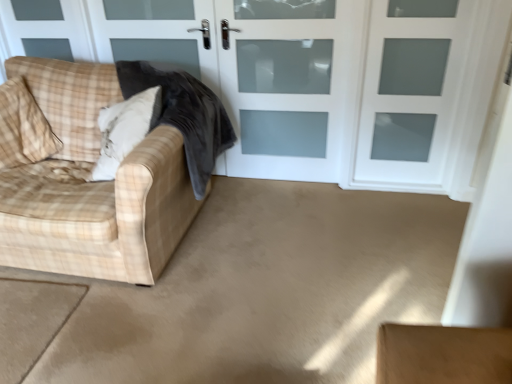
Question: Considering the relative sizes of white frosted glass screen door at upper center, placed as the 2th screen door when sorted from left to right, and plush white pillow at left, which is the first pillow in right-to-left order, in the image provided, is white frosted glass screen door at upper center, placed as the 2th screen door when sorted from left to right, smaller than plush white pillow at left, which is the first pillow in right-to-left order,?

Choices:
 (A) no
 (B) yes

Answer: (B)

Question: Does white frosted glass screen door at upper center, placed as the 2th screen door when sorted from left to right, turn towards plush white pillow at left, the second pillow from the left?

Choices:
 (A) yes
 (B) no

Answer: (B)

Question: Could plush white pillow at left, which is the first pillow in right-to-left order, be considered to be inside white frosted glass screen door at upper center, which is counted as the 1th screen door, starting from the right?

Choices:
 (A) yes
 (B) no

Answer: (B)

Question: Is the surface of white frosted glass screen door at upper center, placed as the 2th screen door when sorted from left to right, in direct contact with plush white pillow at left, the second pillow from the left?

Choices:
 (A) yes
 (B) no

Answer: (B)

Question: Can you confirm if white frosted glass screen door at upper center, placed as the 2th screen door when sorted from left to right, is bigger than plush white pillow at left, which is the first pillow in right-to-left order?

Choices:
 (A) yes
 (B) no

Answer: (B)

Question: Considering their positions, is velvet dark gray blanket at left located in front of or behind white frosted glass screen door at upper center, which is counted as the 1th screen door, starting from the right?

Choices:
 (A) front
 (B) behind

Answer: (A)

Question: From the image's perspective, is velvet dark gray blanket at left located above or below white frosted glass screen door at upper center, placed as the 2th screen door when sorted from left to right?

Choices:
 (A) below
 (B) above

Answer: (A)

Question: Looking at their shapes, would you say velvet dark gray blanket at left is wider or thinner than white frosted glass screen door at upper center, placed as the 2th screen door when sorted from left to right?

Choices:
 (A) wide
 (B) thin

Answer: (A)

Question: Would you say velvet dark gray blanket at left is inside or outside white frosted glass screen door at upper center, which is counted as the 1th screen door, starting from the right?

Choices:
 (A) inside
 (B) outside

Answer: (B)

Question: From their relative heights in the image, would you say beige carpet at lower left is taller or shorter than white frosted glass door at center, which ranks as the first screen door in left-to-right order?

Choices:
 (A) tall
 (B) short

Answer: (B)

Question: From a real-world perspective, is beige carpet at lower left positioned above or below white frosted glass door at center, marked as the 2th screen door in a right-to-left arrangement?

Choices:
 (A) below
 (B) above

Answer: (A)

Question: Relative to white frosted glass door at center, marked as the 2th screen door in a right-to-left arrangement, is beige carpet at lower left in front or behind?

Choices:
 (A) front
 (B) behind

Answer: (A)

Question: From the image's perspective, is beige carpet at lower left above or below white frosted glass door at center, which ranks as the first screen door in left-to-right order?

Choices:
 (A) above
 (B) below

Answer: (B)

Question: Considering the positions of plush white pillow at left, which is the first pillow in right-to-left order, and white frosted glass screen door at upper center, which is counted as the 1th screen door, starting from the right, in the image, is plush white pillow at left, which is the first pillow in right-to-left order, wider or thinner than white frosted glass screen door at upper center, which is counted as the 1th screen door, starting from the right,?

Choices:
 (A) thin
 (B) wide

Answer: (B)

Question: Is plush white pillow at left, which is the first pillow in right-to-left order, inside the boundaries of white frosted glass screen door at upper center, placed as the 2th screen door when sorted from left to right, or outside?

Choices:
 (A) inside
 (B) outside

Answer: (B)